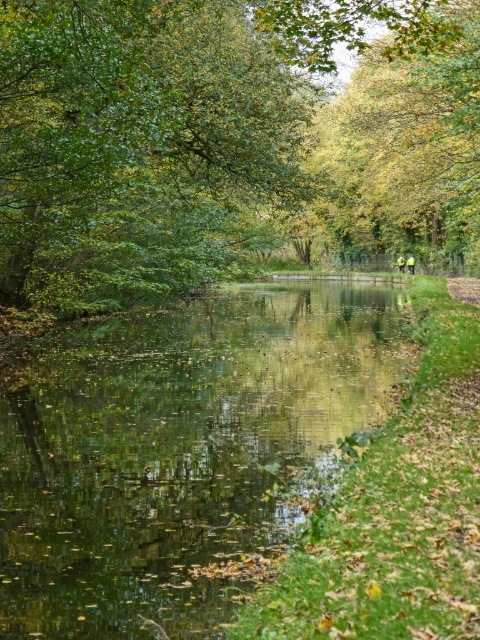
Can you confirm if green leafy tree at center is wider than green reflective water at center?

Yes.

Is green leafy tree at center smaller than green reflective water at center?

Incorrect, green leafy tree at center is not smaller in size than green reflective water at center.

Between point (470, 70) and point (184, 637), which one is positioned behind?

The point (470, 70) is more distant.

Where is `green leafy tree at center`? green leafy tree at center is located at coordinates (228, 141).